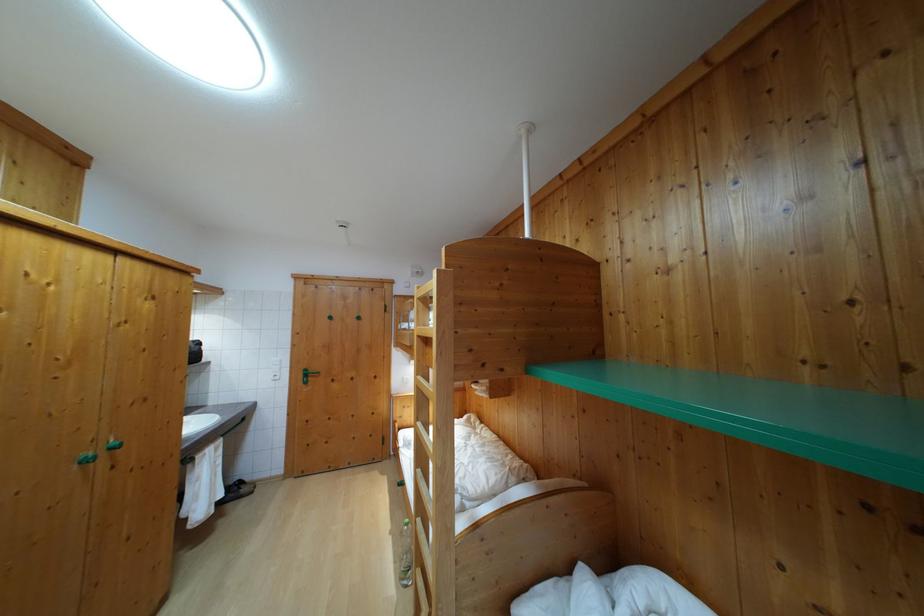
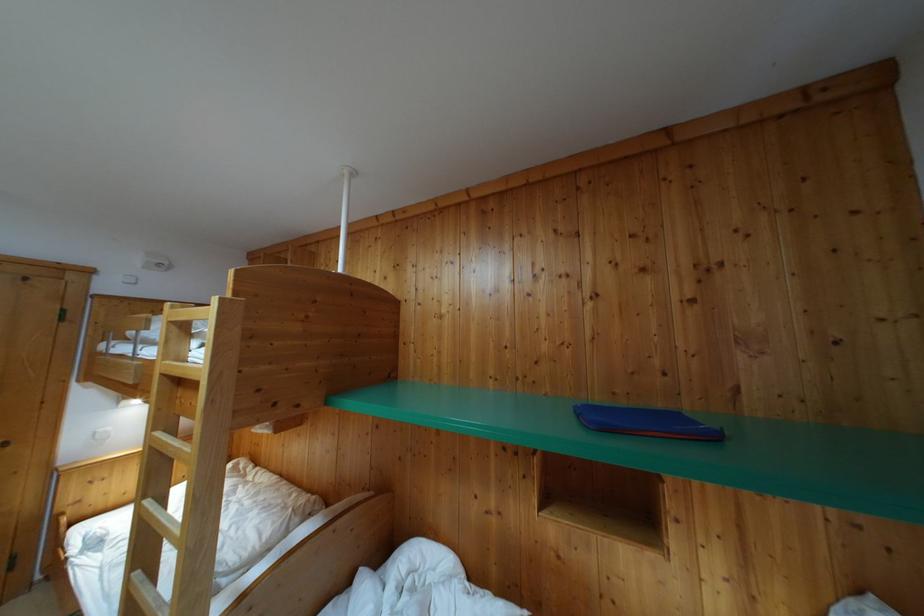
Question: The first image is from the beginning of the video and the second image is from the end. How did the camera likely rotate when shooting the video?

Choices:
 (A) Left
 (B) Right
 (C) Up
 (D) Down

Answer: (B)